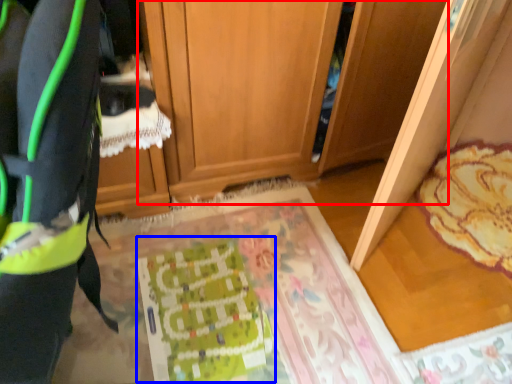
Question: Which object is closer to the camera taking this photo, cabinetry (highlighted by a red box) or wrapping paper (highlighted by a blue box)?

Choices:
 (A) cabinetry
 (B) wrapping paper

Answer: (A)